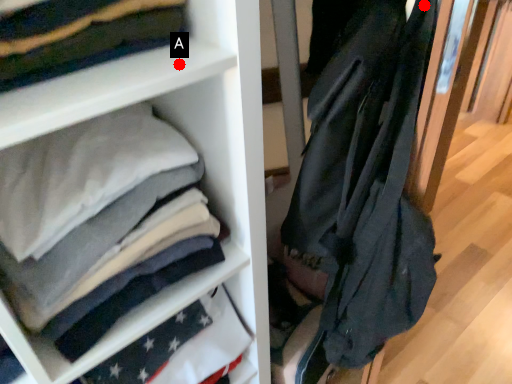
Question: Two points are circled on the image, labeled by A and B beside each circle. Which point appears farthest from the camera in this image?

Choices:
 (A) A is further
 (B) B is further

Answer: (B)